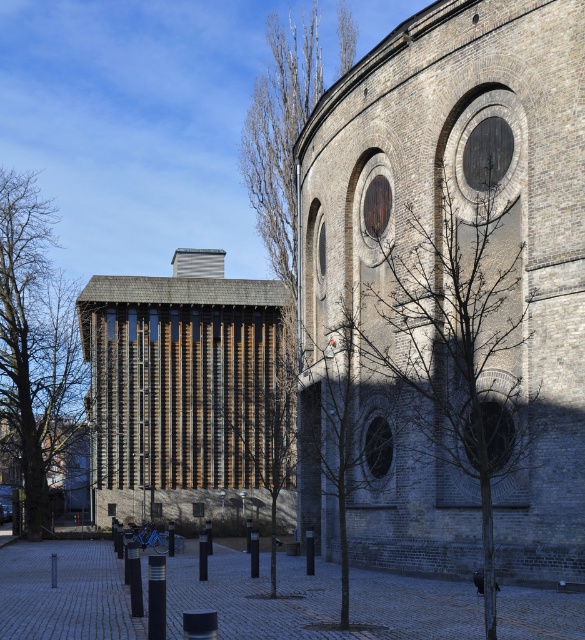
Who is positioned more to the right, bare branches at center or bare branches at upper center?

bare branches at center

Who is higher up, bare branches at center or bare branches at upper center?

bare branches at upper center is above.

Describe the element at coordinates (446, 342) in the screenshot. I see `bare branches at center` at that location.

Locate an element on the screen. This screenshot has height=640, width=585. bare branches at center is located at coordinates (446, 342).

Which is in front, point (178, 429) or point (278, 433)?

Point (278, 433) is more forward.

At what (x,y) coordinates should I click in order to perform the action: click on wooden slats at center. Please return your answer as a coordinate pair (x, y). Looking at the image, I should click on (187, 392).

Between bare branches at upper center and green leafy tree at center, which one is positioned lower?

green leafy tree at center is lower down.

This screenshot has height=640, width=585. In order to click on bare branches at upper center in this screenshot , I will do `click(280, 136)`.